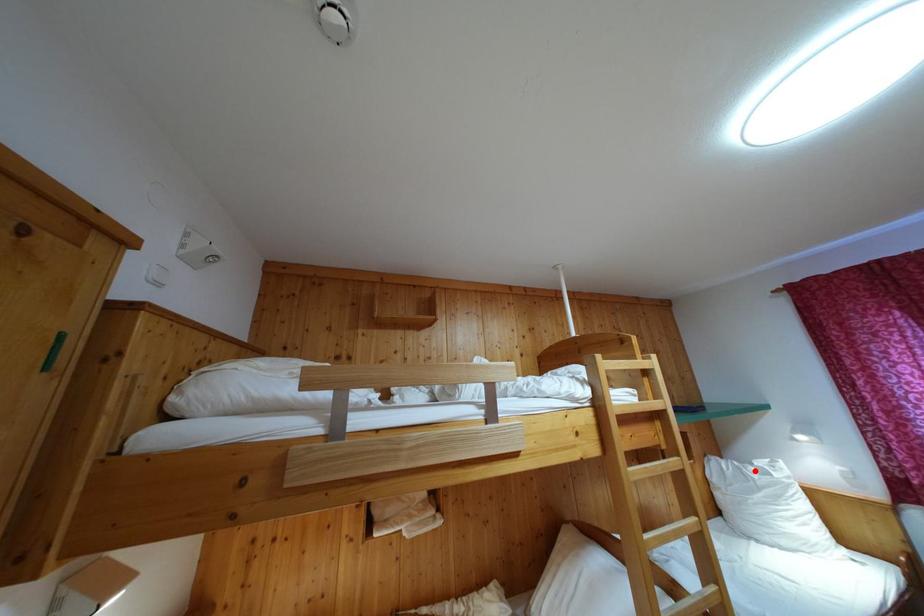
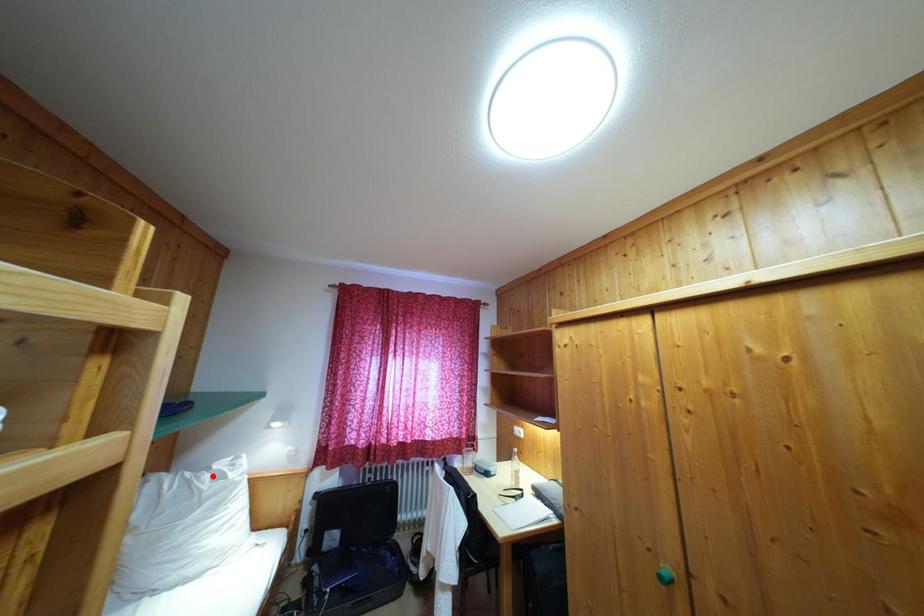
I am providing you with two images of the same scene from different viewpoints. A red point is marked on the first image and another point is marked on the second image. Do the highlighted points in image1 and image2 indicate the same real-world spot?

Yes